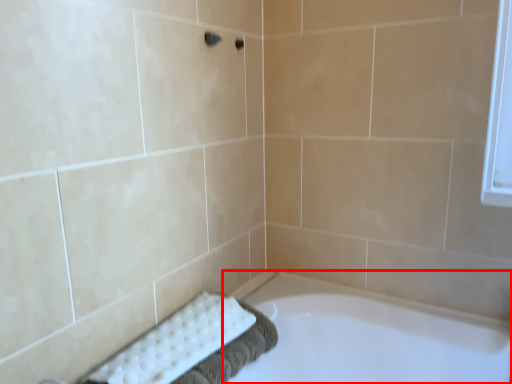
Question: Observing the image, what is the correct spatial positioning of bathtub (annotated by the red box) in reference to bath towel?

Choices:
 (A) right
 (B) left

Answer: (A)